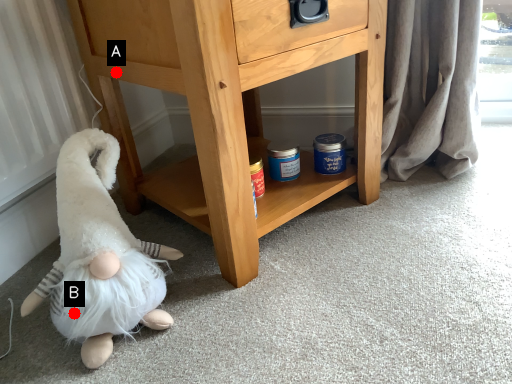
Question: Two points are circled on the image, labeled by A and B beside each circle. Which of the following is the farthest from the observer?

Choices:
 (A) A is further
 (B) B is further

Answer: (A)